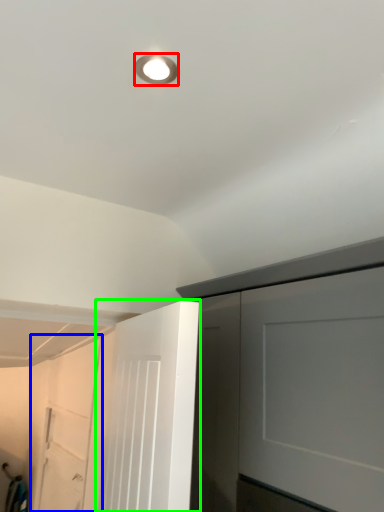
Question: Based on their relative distances, which object is farther from droplight (highlighted by a red box)? Choose from garage door (highlighted by a blue box) and door (highlighted by a green box).

Choices:
 (A) garage door
 (B) door

Answer: (A)